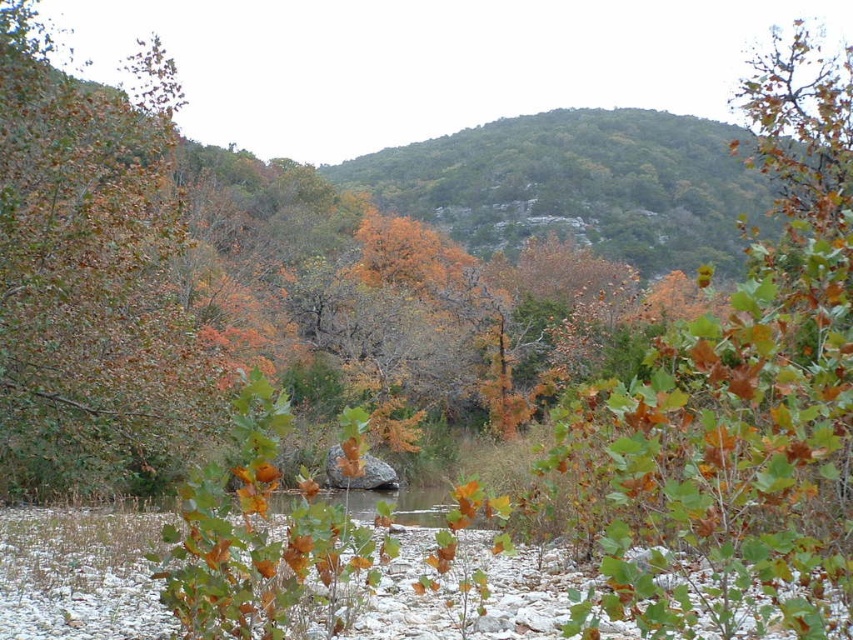
Can you confirm if green matte tree at center is positioned below green leafy tree at left?

Result: No.

Which is below, green matte tree at center or green leafy tree at left?

green leafy tree at left is below.

Image resolution: width=853 pixels, height=640 pixels. Identify the location of green matte tree at center. (740, 404).